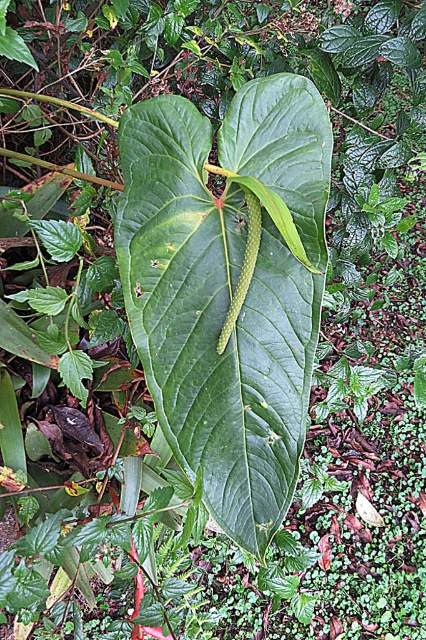
You are a gardener examining the plant at the center. You notice the green matte leaf at center and the green smooth caterpillar at center. Which object is wider?

The green matte leaf at center is wider than the green smooth caterpillar at center.

You are a gardener observing the central area of the plant. You notice the green matte leaf at center and the green smooth caterpillar at center. Which object is positioned to the left?

The green matte leaf at center is to the left of the green smooth caterpillar at center.